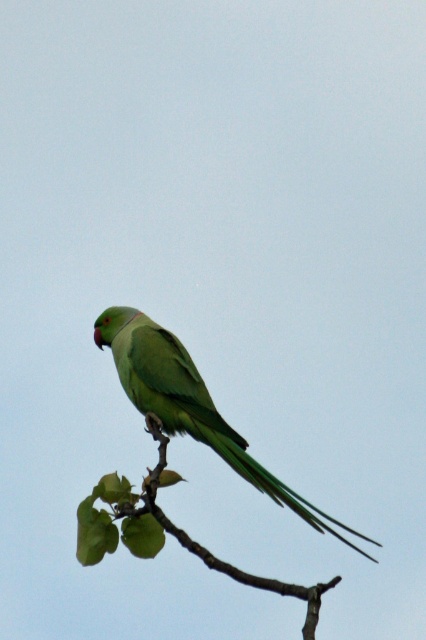
Question: Among these points, which one is nearest to the camera?

Choices:
 (A) (227, 572)
 (B) (193, 412)

Answer: (A)

Question: Where is green matte parrot at center located in relation to green matte tree branch at center in the image?

Choices:
 (A) left
 (B) right

Answer: (B)

Question: Can you confirm if green matte parrot at center is positioned below green matte tree branch at center?

Choices:
 (A) yes
 (B) no

Answer: (B)

Question: Among these points, which one is nearest to the camera?

Choices:
 (A) (195, 419)
 (B) (164, 461)

Answer: (B)

Question: Can you confirm if green matte parrot at center is wider than green matte tree branch at center?

Choices:
 (A) no
 (B) yes

Answer: (B)